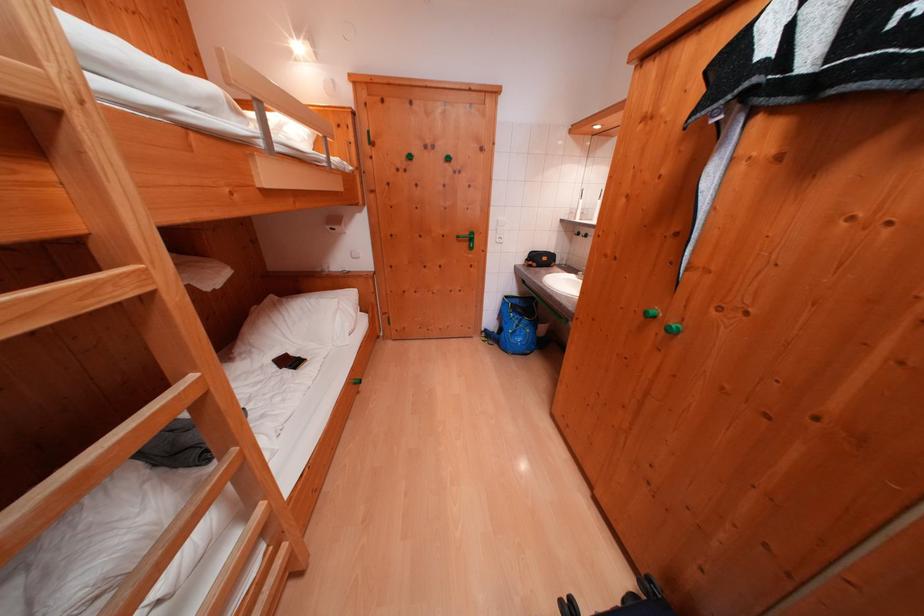
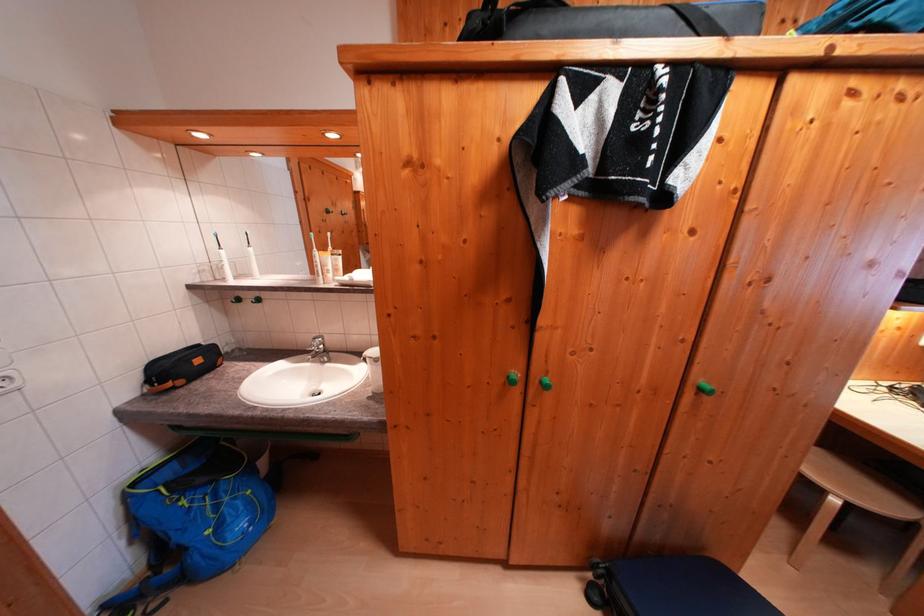
Find the pixel in the second image that matches the point at 515,301 in the first image.

(142, 488)